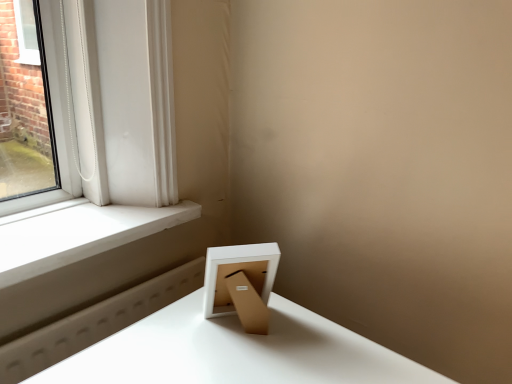
Question: From a real-world perspective, is white matte picture frame at lower right under white smooth window sill at left?

Choices:
 (A) no
 (B) yes

Answer: (A)

Question: Does white matte picture frame at lower right appear on the right side of white smooth window sill at left?

Choices:
 (A) yes
 (B) no

Answer: (A)

Question: Is white matte picture frame at lower right positioned far away from white smooth window sill at left?

Choices:
 (A) no
 (B) yes

Answer: (A)

Question: From a real-world perspective, is white matte picture frame at lower right on top of white smooth window sill at left?

Choices:
 (A) yes
 (B) no

Answer: (A)

Question: Is white matte picture frame at lower right outside white smooth window sill at left?

Choices:
 (A) yes
 (B) no

Answer: (A)

Question: Can you confirm if white matte picture frame at lower right is bigger than white smooth window sill at left?

Choices:
 (A) no
 (B) yes

Answer: (A)

Question: Can you confirm if white smooth window sill at left is bigger than white matte picture frame at lower right?

Choices:
 (A) no
 (B) yes

Answer: (B)

Question: Does white smooth window sill at left turn towards white matte picture frame at lower right?

Choices:
 (A) no
 (B) yes

Answer: (B)

Question: From a real-world perspective, is white smooth window sill at left located beneath white matte picture frame at lower right?

Choices:
 (A) no
 (B) yes

Answer: (B)

Question: Is white smooth window sill at left not inside white matte picture frame at lower right?

Choices:
 (A) no
 (B) yes

Answer: (B)

Question: From the image's perspective, is white smooth window sill at left on top of white matte picture frame at lower right?

Choices:
 (A) yes
 (B) no

Answer: (A)

Question: Is white smooth window sill at left directly adjacent to white matte picture frame at lower right?

Choices:
 (A) yes
 (B) no

Answer: (B)

Question: Is white matte picture frame at lower right to the left or to the right of white smooth window sill at left in the image?

Choices:
 (A) right
 (B) left

Answer: (A)